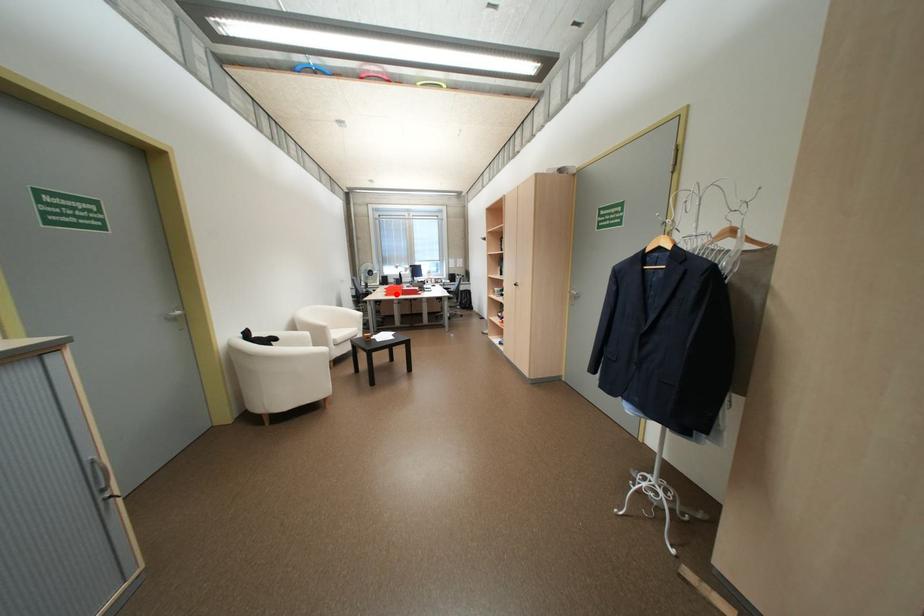
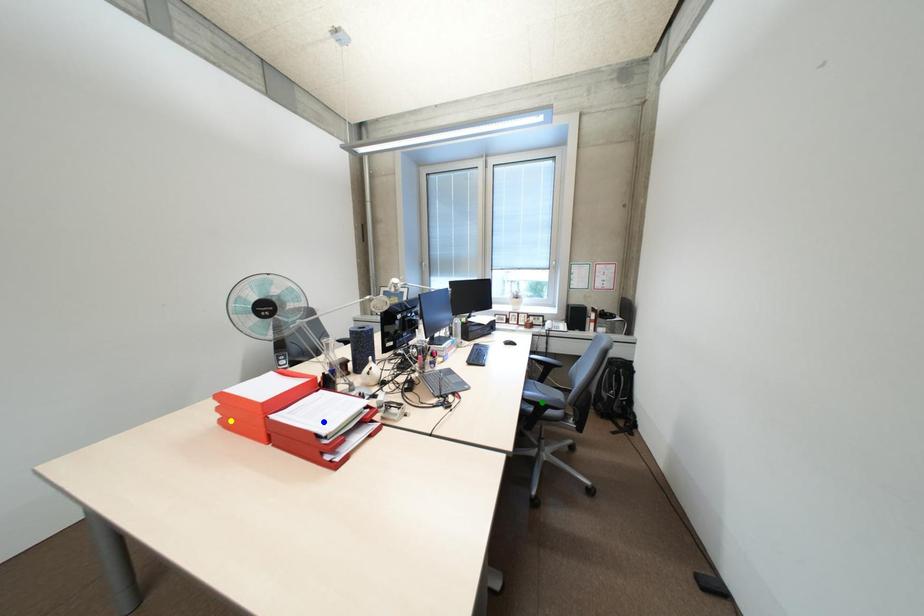
Question: I am providing you with two images of the same scene from different viewpoints. A red point is marked on the first image. You are given multiple points on the second image. Which mark in image 2 goes with the point in image 1?

Choices:
 (A) yellow point
 (B) blue point
 (C) green point

Answer: (A)